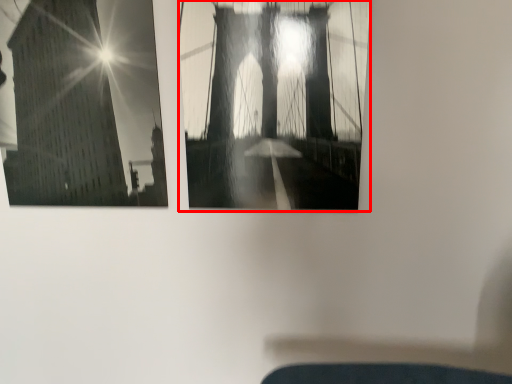
Question: From the image's perspective, what is the correct spatial positioning of window (annotated by the red box) in reference to window?

Choices:
 (A) below
 (B) above

Answer: (A)